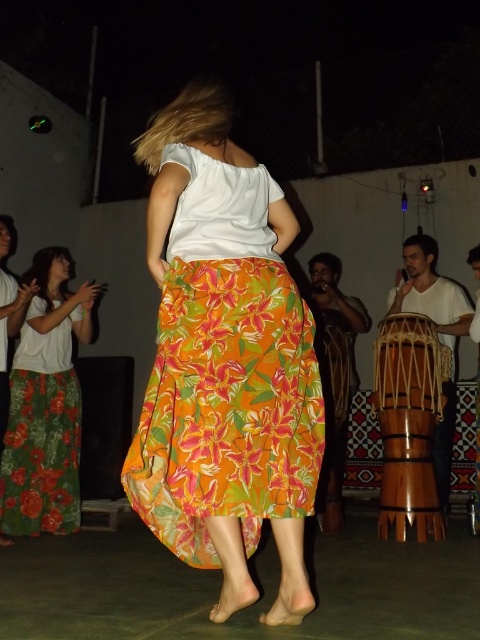
Question: Does floral cotton skirt at center appear on the left side of green floral skirt at left?

Choices:
 (A) no
 (B) yes

Answer: (A)

Question: From the image, what is the correct spatial relationship of floral cotton skirt at center in relation to green floral skirt at left?

Choices:
 (A) left
 (B) right

Answer: (B)

Question: Among these objects, which one is nearest to the camera?

Choices:
 (A) green floral skirt at left
 (B) floral cotton skirt at center

Answer: (B)

Question: Which point is closer to the camera?

Choices:
 (A) floral cotton skirt at center
 (B) green floral skirt at left

Answer: (A)

Question: Is green floral skirt at left positioned in front of wooden drum at lower right?

Choices:
 (A) yes
 (B) no

Answer: (B)

Question: Which of the following is the closest to the observer?

Choices:
 (A) (189, 314)
 (B) (72, 326)

Answer: (A)